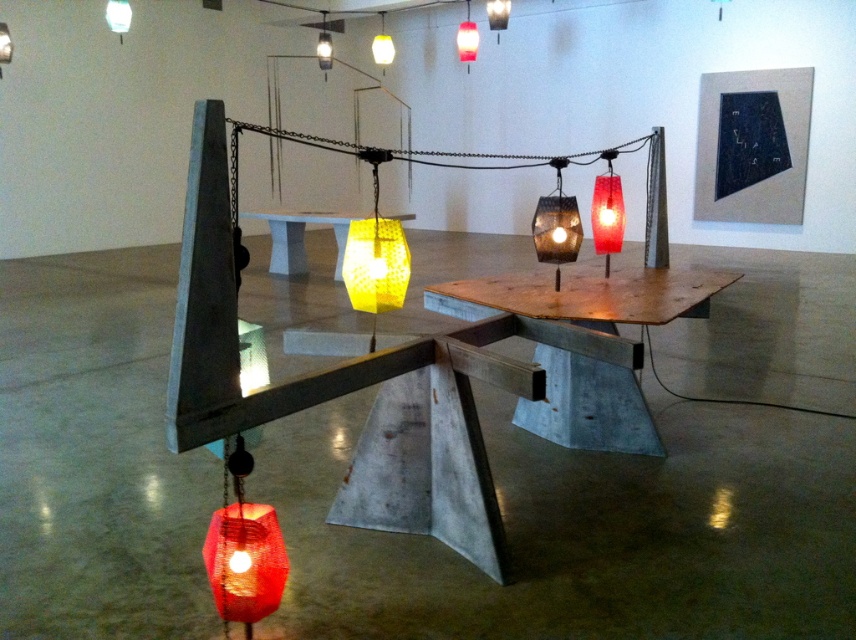
Which is more to the right, yellow matte lantern at center or matte red glass lantern at upper center?

matte red glass lantern at upper center

What do you see at coordinates (375, 264) in the screenshot? This screenshot has width=856, height=640. I see `yellow matte lantern at center` at bounding box center [375, 264].

I want to click on yellow matte lantern at center, so (375, 264).

Find the location of a particular element. yellow matte lantern at center is located at coordinates (375, 264).

Who is shorter, matte white lampshade at upper left or matte yellow glass lamp at center?

Answer: matte white lampshade at upper left is shorter.

Where is `matte white lampshade at upper left`? Image resolution: width=856 pixels, height=640 pixels. matte white lampshade at upper left is located at coordinates (117, 17).

Between point (111, 29) and point (383, 52), which one is positioned in front?

Point (111, 29) is more forward.

Locate an element on the screen. matte white lampshade at upper left is located at coordinates (117, 17).

Is metallic chain at center wider than matte black lampshade at upper center?

Yes.

This screenshot has width=856, height=640. Find the location of `metallic chain at center`. metallic chain at center is located at coordinates (379, 148).

Image resolution: width=856 pixels, height=640 pixels. I want to click on metallic chain at center, so click(x=379, y=148).